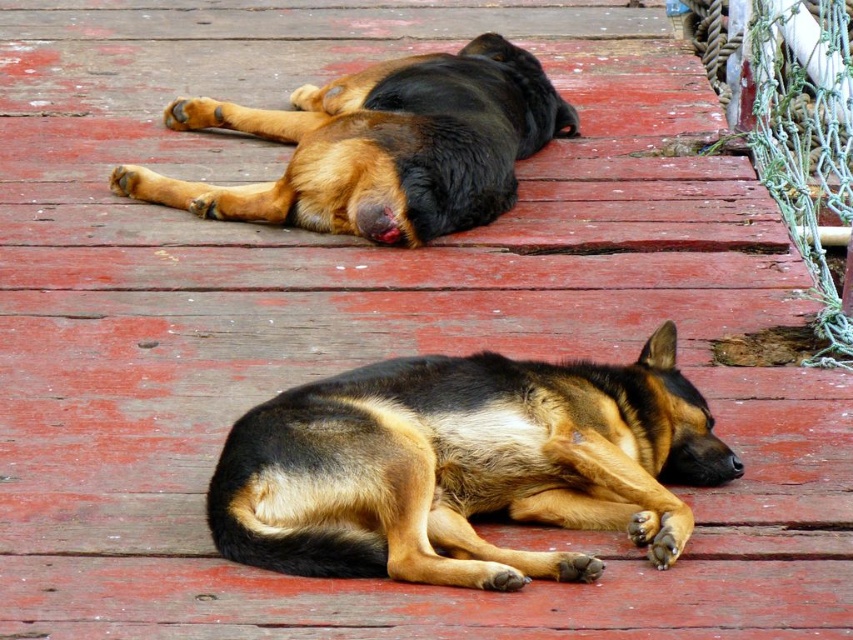
Is black and tan fur dog at center to the right of brown-black fur dog at upper center from the viewer's perspective?

Indeed, black and tan fur dog at center is positioned on the right side of brown-black fur dog at upper center.

Can you confirm if black and tan fur dog at center is bigger than brown-black fur dog at upper center?

Incorrect, black and tan fur dog at center is not larger than brown-black fur dog at upper center.

Is point (480, 380) positioned behind point (397, 120)?

No, it is not.

Image resolution: width=853 pixels, height=640 pixels. In order to click on black and tan fur dog at center in this screenshot , I will do `click(463, 467)`.